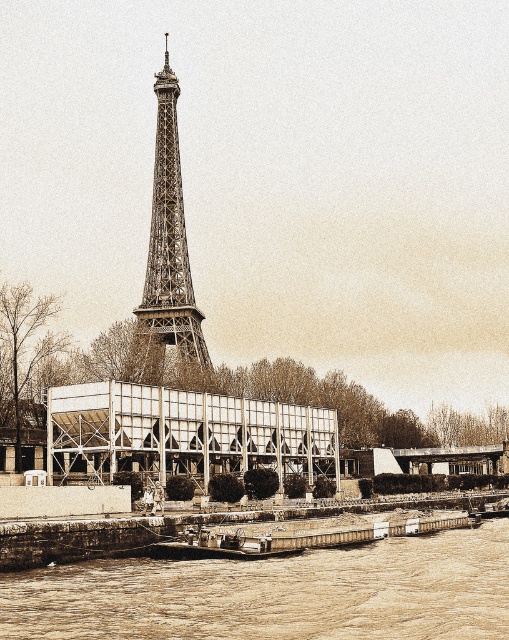
Question: Which object is positioned closest to the metallic lattice tower at center?

Choices:
 (A) brown sedimentary river at lower center
 (B) rustic wood boat at lower center

Answer: (B)

Question: Does brown sedimentary river at lower center appear on the right side of rustic wood boat at lower center?

Choices:
 (A) yes
 (B) no

Answer: (A)

Question: Does brown sedimentary river at lower center have a lesser width compared to metallic lattice tower at center?

Choices:
 (A) yes
 (B) no

Answer: (B)

Question: From the image, what is the correct spatial relationship of brown sedimentary river at lower center in relation to metallic lattice tower at center?

Choices:
 (A) below
 (B) above

Answer: (A)

Question: Which point is farther to the camera?

Choices:
 (A) metallic lattice tower at center
 (B) rustic wood boat at lower center
 (C) brown sedimentary river at lower center

Answer: (A)

Question: Which object appears closest to the camera in this image?

Choices:
 (A) brown sedimentary river at lower center
 (B) rustic wood boat at lower center

Answer: (A)